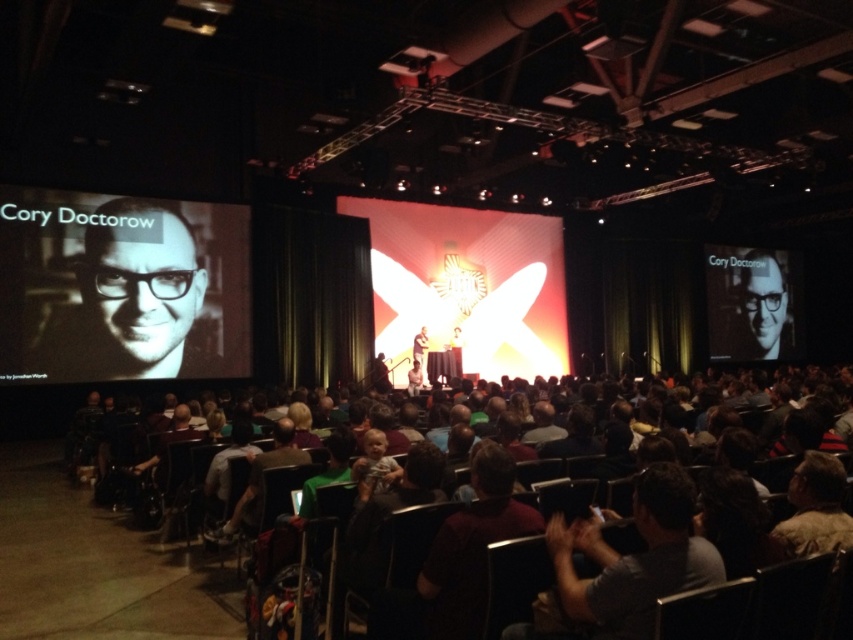
You are an event organizer standing at the back of the auditorium. You need to retrieve your matte black laptop at center from the stage. The dark brown leather chairs at lower center are blocking your path. Can you walk around them to reach the laptop?

The dark brown leather chairs at lower center are 11.44 meters away from the matte black laptop at center. Since the chairs are positioned between you and the laptop, you can walk around them to reach the laptop as the distance allows for maneuvering space.

You are setting up for a presentation and need to place a matte black laptop at center on a table. There is a matte black screen at left already placed. Considering their widths, which object is wider?

The matte black screen at left is wider than the matte black laptop at center.